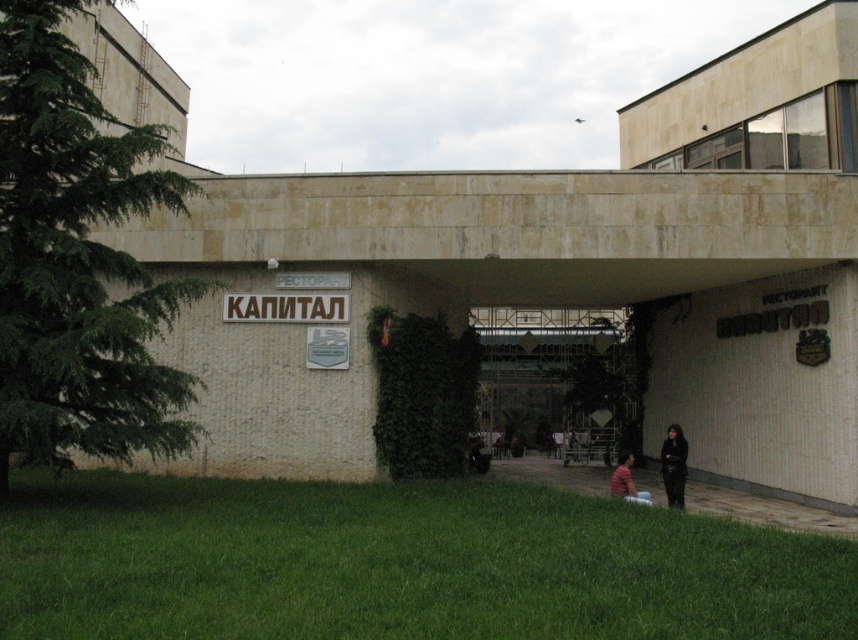
Question: Which of these objects is positioned farthest from the dark gray jacket at lower right?

Choices:
 (A) striped cotton shirt at lower center
 (B) transparent glass entrance at center

Answer: (B)

Question: Is green grass at lower center above dark gray jacket at lower right?

Choices:
 (A) yes
 (B) no

Answer: (A)

Question: Can you confirm if dark gray jacket at lower right is thinner than striped cotton shirt at lower center?

Choices:
 (A) yes
 (B) no

Answer: (B)

Question: Can you confirm if green grass at lower center is bigger than striped cotton shirt at lower center?

Choices:
 (A) yes
 (B) no

Answer: (A)

Question: Which object is the farthest from the transparent glass entrance at center?

Choices:
 (A) dark gray jacket at lower right
 (B) green grass at lower center

Answer: (B)

Question: Which point appears closest to the camera in this image?

Choices:
 (A) (170, 611)
 (B) (668, 504)

Answer: (A)